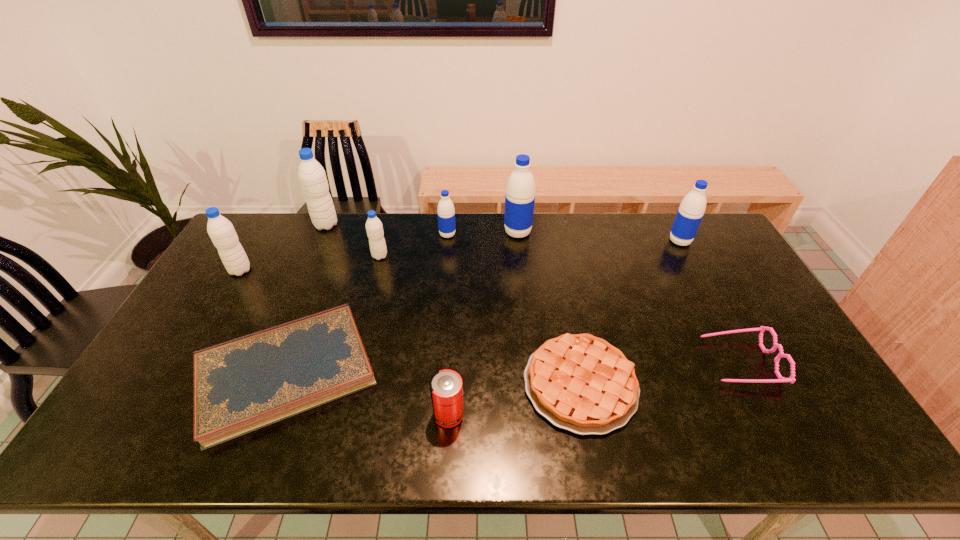
The width and height of the screenshot is (960, 540). I want to click on the second water bottle from left to right, so (x=312, y=177).

The image size is (960, 540). What are the coordinates of `the farthest gray water bottle` in the screenshot? It's located at (312, 177).

This screenshot has width=960, height=540. Identify the location of the biggest blue water bottle. (520, 192).

Find the location of a particular element. This screenshot has width=960, height=540. the fifth water bottle from left to right is located at coordinates (520, 192).

Where is `the fifth nearest object`? The width and height of the screenshot is (960, 540). the fifth nearest object is located at coordinates (221, 231).

In order to click on the nearest gray water bottle in this screenshot , I will do `click(221, 231)`.

I want to click on the second smallest blue water bottle, so click(691, 211).

Find the location of a particular element. the rightmost water bottle is located at coordinates (691, 211).

This screenshot has height=540, width=960. I want to click on the third water bottle from right to left, so click(446, 213).

Locate an element on the screen. The image size is (960, 540). the leftmost blue water bottle is located at coordinates (446, 213).